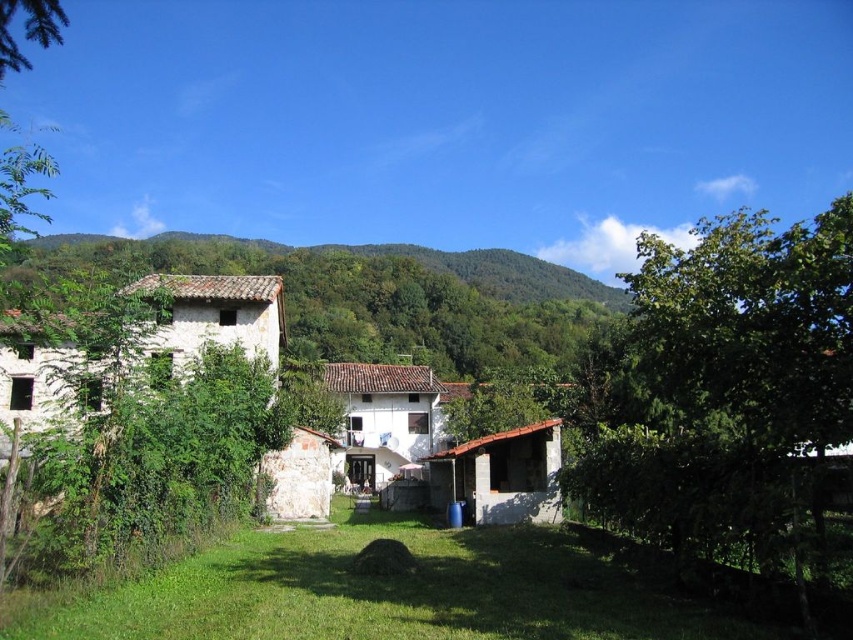
You are standing in the garden and want to walk from the green grass at lower center to the green leafy hillside at left. Which path would require walking a shorter distance?

The green grass at lower center has a lesser width compared to the green leafy hillside at left, so walking to the green grass at lower center would require a shorter distance since it is narrower.

You are standing in the garden looking at the green leafy tree at right and the green grass at lower center. Which object is taller?

The green leafy tree at right is much taller than the green grass at lower center.

You are planning to plant a new tree in your backyard. You have two options based on the image you see. The first is the green leafy tree at right, and the second is the green leafy hillside at left. Which option would require more space horizontally if you want to plant it?

The green leafy hillside at left requires more horizontal space because its width is greater than the green leafy tree at right.